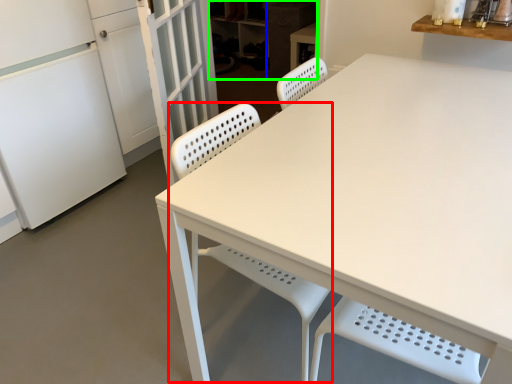
Question: Considering the real-world distances, which object is farthest from chair (highlighted by a red box)? cabinetry (highlighted by a blue box) or cabinetry (highlighted by a green box)?

Choices:
 (A) cabinetry
 (B) cabinetry

Answer: (B)